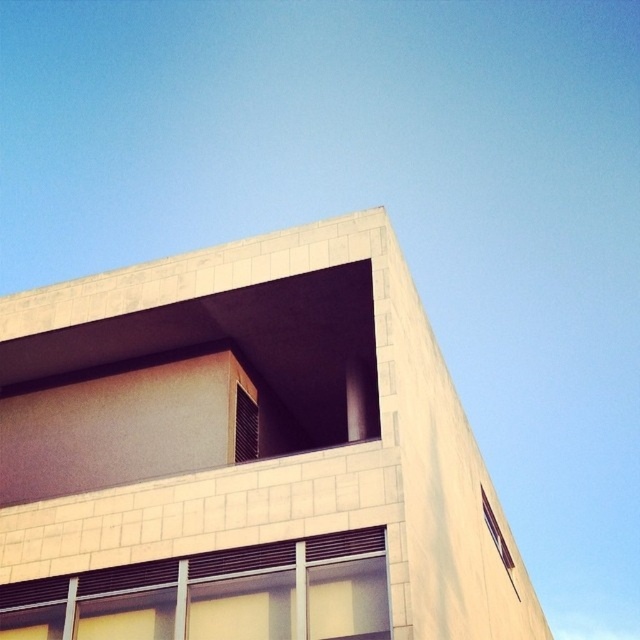
Question: Among these points, which one is nearest to the camera?

Choices:
 (A) (33, 618)
 (B) (492, 512)

Answer: (A)

Question: Is white textured window at lower center positioned before transparent glass window at upper right?

Choices:
 (A) no
 (B) yes

Answer: (B)

Question: Does white textured window at lower center have a greater width compared to transparent glass window at upper right?

Choices:
 (A) yes
 (B) no

Answer: (A)

Question: Is white textured window at lower center above transparent glass window at upper right?

Choices:
 (A) no
 (B) yes

Answer: (B)